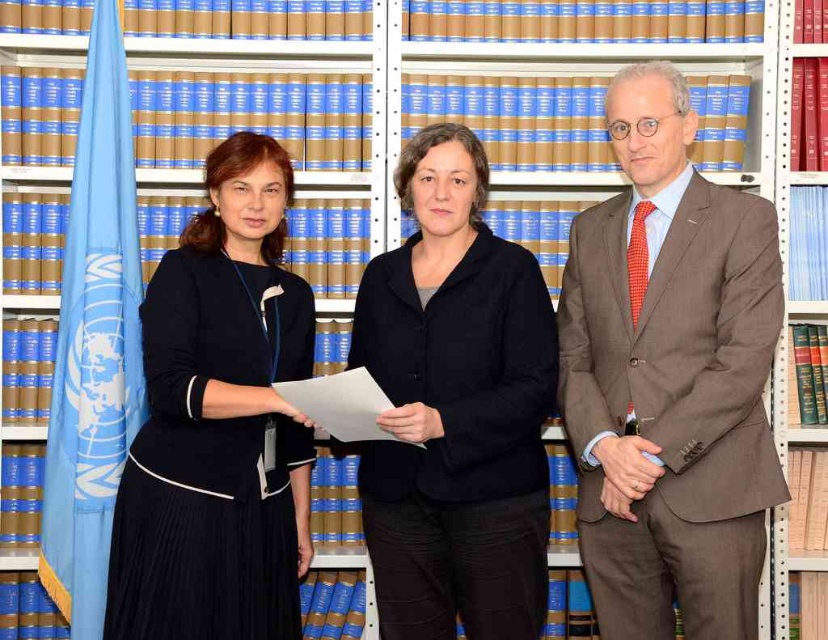
Question: Is brown suit at center above matte black dress at center?

Choices:
 (A) yes
 (B) no

Answer: (A)

Question: Observing the image, what is the correct spatial positioning of brown suit at center in reference to matte black dress at center?

Choices:
 (A) left
 (B) right

Answer: (B)

Question: Does brown suit at center have a smaller size compared to black matte blazer at center?

Choices:
 (A) no
 (B) yes

Answer: (A)

Question: Among these objects, which one is nearest to the camera?

Choices:
 (A) brown suit at center
 (B) black matte blazer at center

Answer: (B)

Question: Which of these objects is positioned closest to the black matte blazer at center?

Choices:
 (A) brown suit at center
 (B) matte black dress at center

Answer: (A)

Question: Among these points, which one is farthest from the camera?

Choices:
 (A) (498, 452)
 (B) (607, 291)
 (C) (294, 372)

Answer: (B)